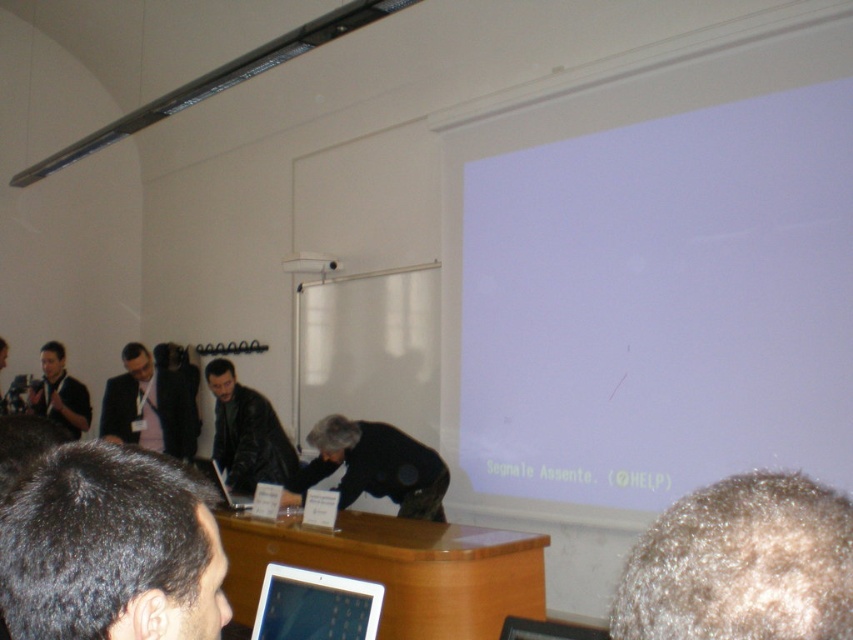
You are a photographer standing in the room. You need to capture a photo of the dark brown hair at lower left and the white plastic projector at upper center. Based on their heights, which object should you focus on first if you want to ensure both are in focus without adjusting your camera settings?

The dark brown hair at lower left is taller than the white plastic projector at upper center, so you should focus on the dark brown hair at lower left first to ensure both are in focus.

From the picture: You are organizing a presentation and need to know if the gray hair at upper right can fit entirely within the wooden table at center. Based on their sizes, can it fit?

The gray hair at upper right is narrower than the wooden table at center, so it can fit entirely within the wooden table at center.

You are a participant in the conference room. You see the dark gray fabric at center and the leather jacket at center. Which object is closer to the right side of the room?

The dark gray fabric at center is closer to the right side of the room because it is positioned to the right of the leather jacket at center.